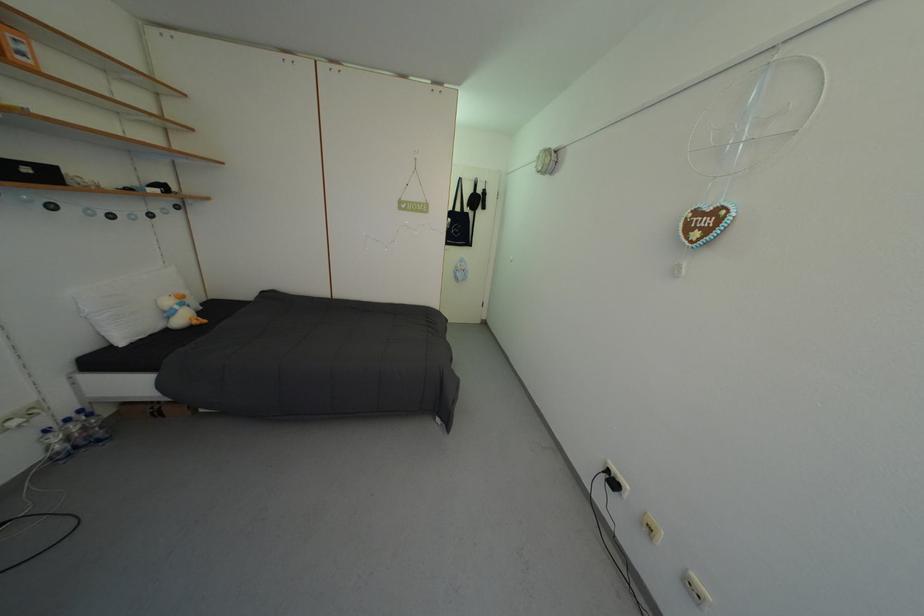
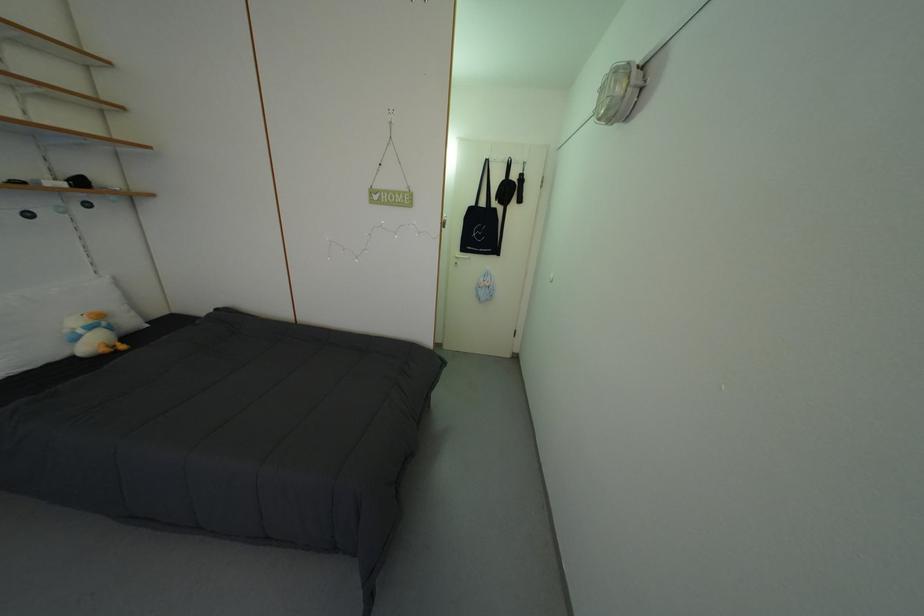
Looking at this image, in a continuous first-person perspective shot, in which direction is the camera moving?

The cameraman walked toward right, forward.